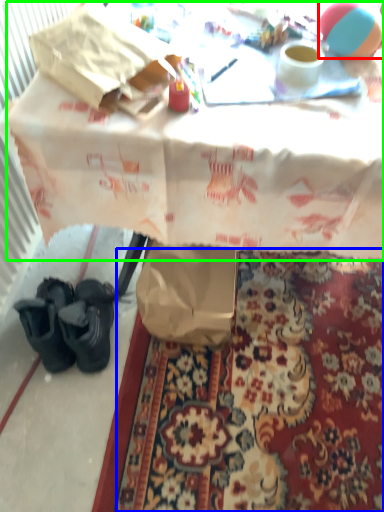
Question: Considering the real-world distances, which object is closest to ball (highlighted by a red box)? mat (highlighted by a blue box) or table (highlighted by a green box).

Choices:
 (A) mat
 (B) table

Answer: (B)